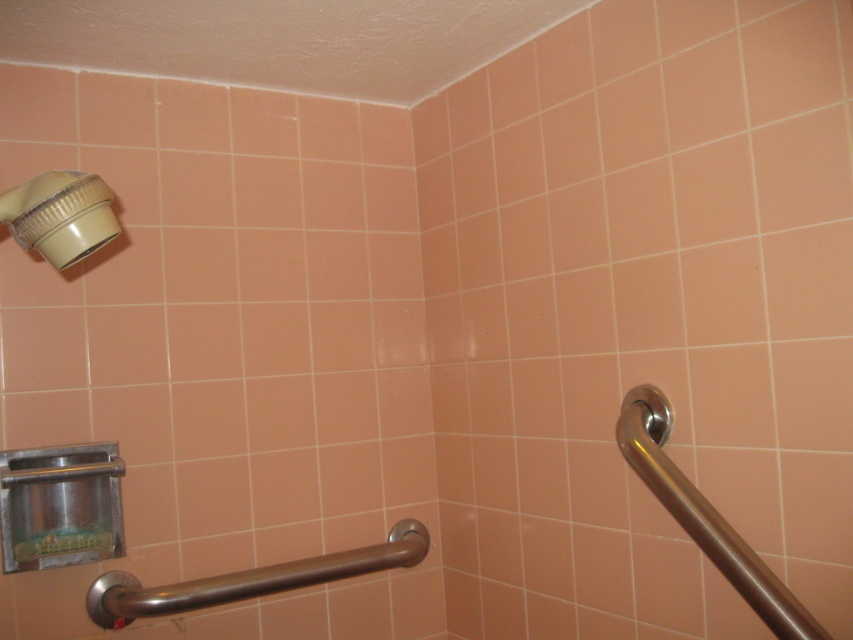
You are designing a shower layout and need to ensure accessibility. The satin nickel grab bar at lower center and the matte white showerhead at upper left are both essential fixtures. Given their sizes, which fixture might require more space in the shower area?

The satin nickel grab bar at lower center requires more space in the shower area since it has a larger size compared to the matte white showerhead at upper left.

You are standing in the shower area and need to reach the matte white showerhead at upper left. Which direction should you move relative to the satin nickel grab bar at lower center?

You should move to the left relative to the satin nickel grab bar at lower center because the matte white showerhead at upper left is positioned to the left of the satin nickel grab bar at lower center.

You are designing a safety audit for this shower area. The grab bar must be installed at least 15 cm away from the showerhead to prevent water damage. The showerhead is located on the left side. Is the polished stainless steel grab bar at right positioned safely according to the requirement?

The polished stainless steel grab bar at right is positioned safely as it is installed at least 15 cm away from the showerhead on the left side to prevent water damage.